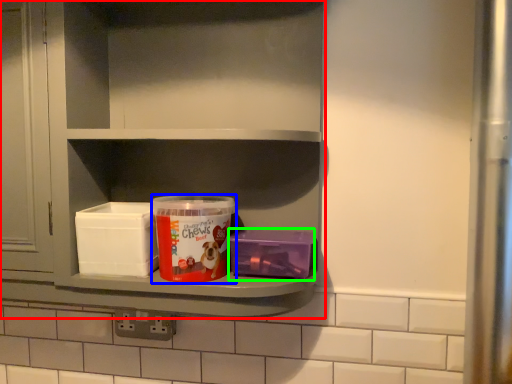
Question: Which object is the closest to the shelf (highlighted by a red box)? Choose among these: product (highlighted by a blue box) or box (highlighted by a green box).

Choices:
 (A) product
 (B) box

Answer: (A)